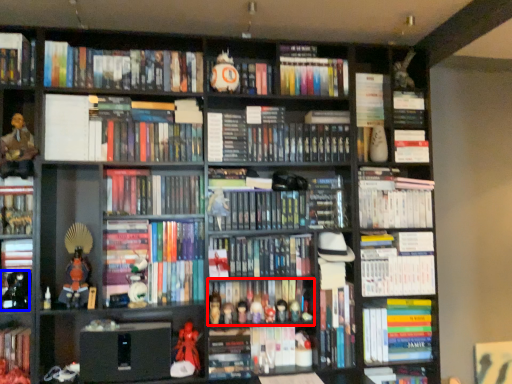
Question: Which point is further to the camera, book (highlighted by a red box) or toy (highlighted by a blue box)?

Choices:
 (A) book
 (B) toy

Answer: (A)